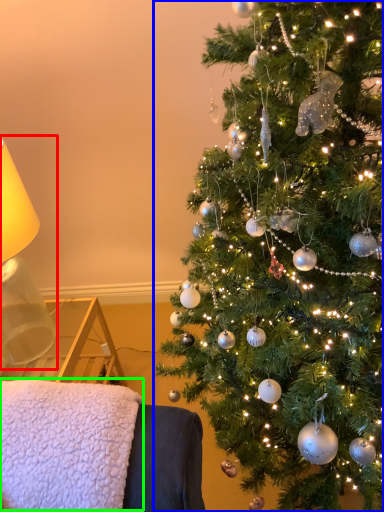
Question: Which object is the farthest from table lamp (highlighted by a red box)? Choose among these: christmas tree (highlighted by a blue box) or blanket (highlighted by a green box).

Choices:
 (A) christmas tree
 (B) blanket

Answer: (A)